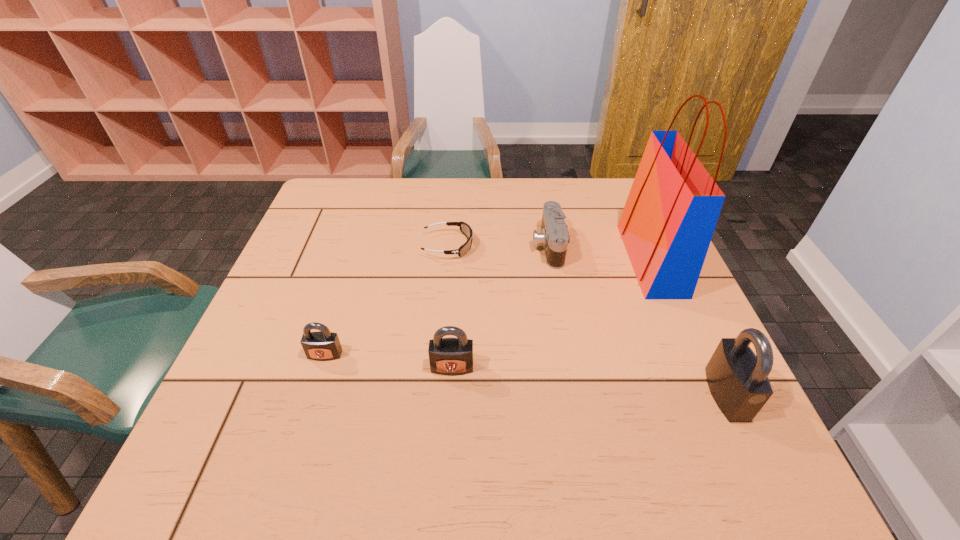
You are a GUI agent. You are given a task and a screenshot of the screen. Output one action in this format:
    pyautogui.click(x=<x>, y=<y>)
    Task: Click on the padlock located in the right edge section of the desktop
    The height and width of the screenshot is (540, 960).
    Given the screenshot: What is the action you would take?
    pyautogui.click(x=738, y=380)

Image resolution: width=960 pixels, height=540 pixels. I want to click on shopping bag that is at the right edge, so click(x=672, y=209).

In order to click on object located at the near right corner in this screenshot , I will do tap(738, 380).

Identify the location of vacant space at the far edge of the desktop. (508, 201).

Locate an element on the screen. vacant space at the near edge of the desktop is located at coordinates 299,417.

Find the location of a particular element. vacant space at the left edge of the desktop is located at coordinates (305, 238).

Find the location of `free space at the right edge of the desktop`. free space at the right edge of the desktop is located at coordinates (653, 360).

In the image, there is a desktop. Identify the location of free space at the near left corner. This screenshot has height=540, width=960. (236, 389).

Where is `unoccupied position between the leftmost object and the third object from right to left`? The image size is (960, 540). unoccupied position between the leftmost object and the third object from right to left is located at coordinates (437, 300).

Image resolution: width=960 pixels, height=540 pixels. Identify the location of vacant space in between the second tallest padlock and the leftmost object. tap(389, 361).